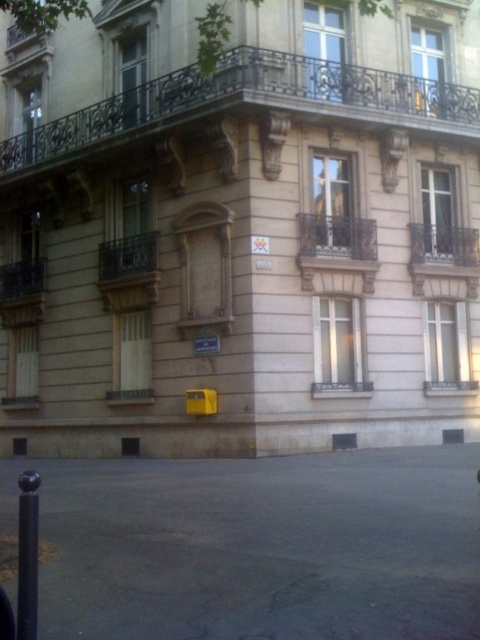
You are standing in front of the building and want to place a new flower pot on the dark brown wrought iron balcony at left. According to the coordinates provided, where exactly should you place the flower pot?

The dark brown wrought iron balcony at left is located at point [22,292], so you should place the flower pot there.

You are a delivery person trying to place a package on the nearest balcony. You see the dark brown wrought iron balcony at center and the polished metal balcony at upper right. Which balcony is shorter and thus more accessible for placing the package?

The dark brown wrought iron balcony at center is not as tall as the polished metal balcony at upper right, so it is shorter and more accessible for placing the package.